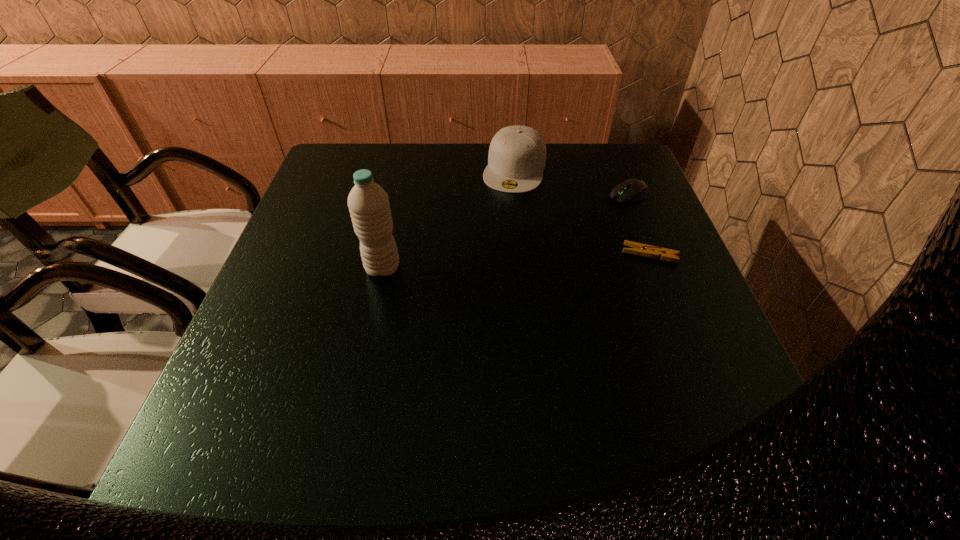
This screenshot has width=960, height=540. I want to click on free spot between the clothespin and the third tallest object, so click(639, 225).

This screenshot has height=540, width=960. Identify the location of vacant area between the leftmost object and the computer mouse. (506, 231).

Find the location of `vacant space that's between the clothespin and the tallest object`. vacant space that's between the clothespin and the tallest object is located at coordinates (516, 261).

Where is `empty space between the computer mouse and the tallest object`? This screenshot has width=960, height=540. empty space between the computer mouse and the tallest object is located at coordinates (506, 231).

Locate an element on the screen. Image resolution: width=960 pixels, height=540 pixels. free space between the third shortest object and the tallest object is located at coordinates (448, 218).

Identify the location of object that stands as the third closest to the computer mouse. (368, 203).

The height and width of the screenshot is (540, 960). Find the location of `object that is the second closest to the clothespin`. object that is the second closest to the clothespin is located at coordinates (517, 154).

The height and width of the screenshot is (540, 960). I want to click on free region that satisfies the following two spatial constraints: 1. on the front side of the clothespin; 2. on the right side of the third shortest object, so click(x=523, y=254).

This screenshot has width=960, height=540. I want to click on free point that satisfies the following two spatial constraints: 1. on the front side of the computer mouse; 2. on the right side of the second tallest object, so point(517,195).

Where is `blank area in the image that satisfies the following two spatial constraints: 1. on the front side of the clothespin; 2. on the left side of the cap`? blank area in the image that satisfies the following two spatial constraints: 1. on the front side of the clothespin; 2. on the left side of the cap is located at coordinates (523, 254).